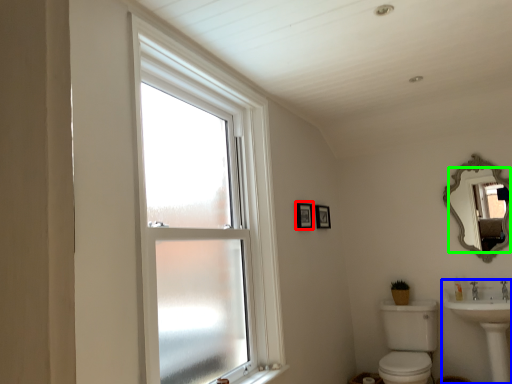
Question: Which object is positioned closest to picture frame (highlighted by a red box)? Select from sink (highlighted by a blue box) and mirror (highlighted by a green box).

Choices:
 (A) sink
 (B) mirror

Answer: (B)